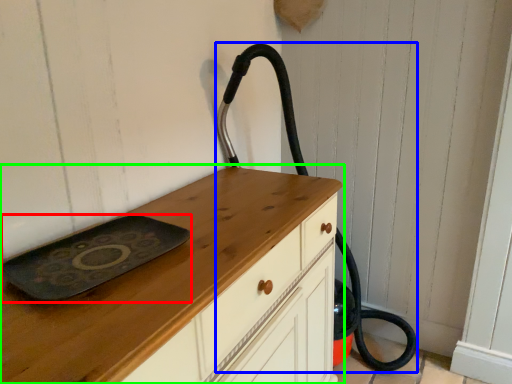
Question: Which is nearer to the tray (highlighted by a red box)? fire hose (highlighted by a blue box) or chest of drawers (highlighted by a green box).

Choices:
 (A) fire hose
 (B) chest of drawers

Answer: (B)